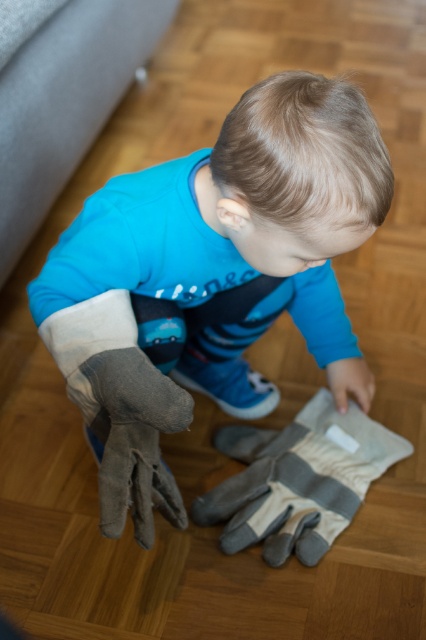
You are a parent trying to choose between the matte gray gloves at center and the gray fabric glove at center for your child to play with. Which one is taller?

The matte gray gloves at center is taller than the gray fabric glove at center.

You are a parent watching your child interact with two gloves on the floor. The child is reaching towards the matte gray gloves at center and the gray fabric glove at center. Which glove is positioned to the left?

The matte gray gloves at center are positioned to the left of the gray fabric glove at center.

You are a parent trying to help your child reach two gray fabric gloves. The gloves are placed on the floor. Which glove should you move so the child can easily grab it? The gloves are labeled as gray fabric glove at center and gray fabric glove at lower left.

You should move the gray fabric glove at lower left to a lower position because the gray fabric glove at center is already below it, making it closer to the child.